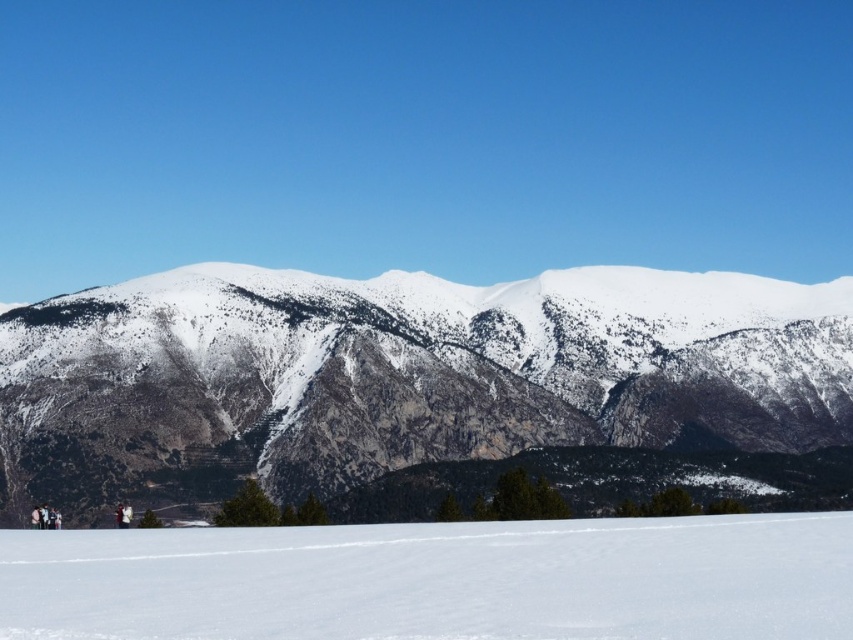
Question: Which point is farther to the camera?

Choices:
 (A) white snow ski slope at lower center
 (B) white rocky mountain at center

Answer: (B)

Question: Does white rocky mountain at center appear under white snow ski slope at lower center?

Choices:
 (A) no
 (B) yes

Answer: (A)

Question: Does white rocky mountain at center have a greater width compared to white snow ski slope at lower center?

Choices:
 (A) yes
 (B) no

Answer: (A)

Question: Which of the following is the closest to the observer?

Choices:
 (A) white rocky mountain at center
 (B) white snow ski slope at lower center

Answer: (B)

Question: Where is white rocky mountain at center located in relation to white snow ski slope at lower center in the image?

Choices:
 (A) above
 (B) below

Answer: (A)

Question: Which point is farther to the camera?

Choices:
 (A) white snow ski slope at lower center
 (B) white rocky mountain at center

Answer: (B)